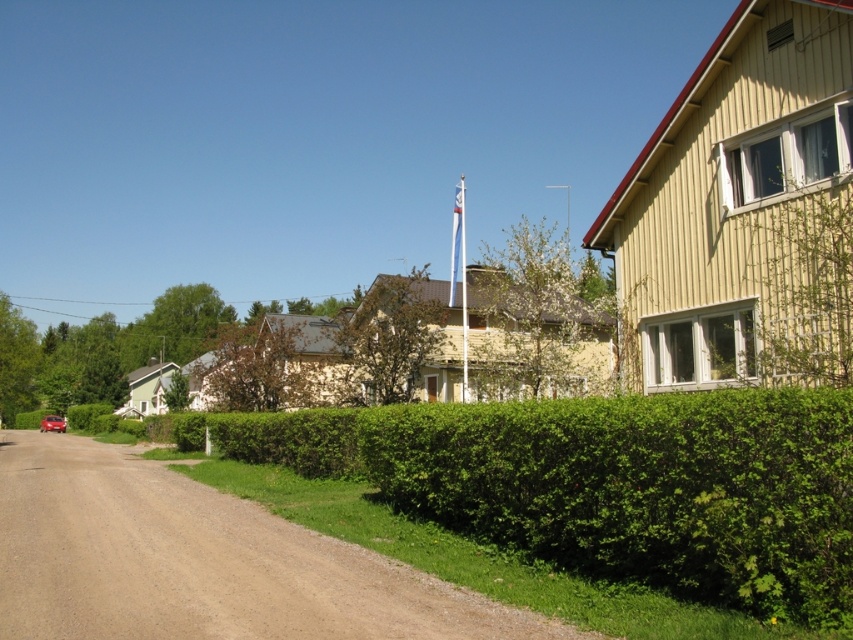
Does brown gravel road at lower left have a greater height compared to shiny red car at lower left?

Correct, brown gravel road at lower left is much taller as shiny red car at lower left.

Between point (32, 548) and point (55, 429), which one is positioned in front?

Point (32, 548)

Identify the location of brown gravel road at lower left. Image resolution: width=853 pixels, height=640 pixels. (200, 561).

Who is shorter, green leafy hedge at center or shiny red car at lower left?

shiny red car at lower left

Is the position of green leafy hedge at center less distant than that of shiny red car at lower left?

Yes, it is in front of shiny red car at lower left.

This screenshot has width=853, height=640. Identify the location of green leafy hedge at center. (608, 483).

You are a GUI agent. You are given a task and a screenshot of the screen. Output one action in this format:
    pyautogui.click(x=<x>, y=<y>)
    Task: Click on the green leafy hedge at center
    
    Given the screenshot: What is the action you would take?
    pyautogui.click(x=608, y=483)

Is point (451, 298) more distant than point (45, 413)?

No, (451, 298) is in front of (45, 413).

Is white fabric flag at center to the left of shiny red car at lower left from the viewer's perspective?

Incorrect, white fabric flag at center is not on the left side of shiny red car at lower left.

Locate an element on the screen. white fabric flag at center is located at coordinates (457, 241).